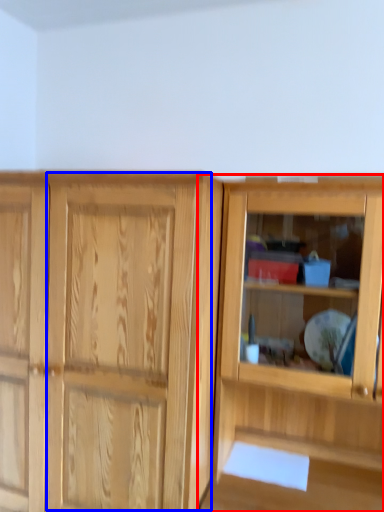
Question: Which point is closer to the camera, cupboard (highlighted by a red box) or screen door (highlighted by a blue box)?

Choices:
 (A) cupboard
 (B) screen door

Answer: (A)